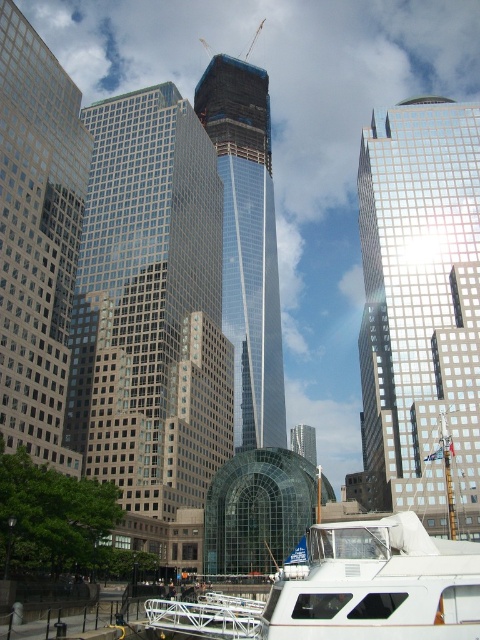
Who is lower down, glassy skyscraper at center or transparent glass skyscraper at center?

Positioned lower is glassy skyscraper at center.

Is point (99, 211) more distant than point (238, 77)?

No.

Locate an element on the screen. The height and width of the screenshot is (640, 480). glassy skyscraper at center is located at coordinates (152, 316).

Between reflective glass skyscraper at center and transparent glass skyscraper at center, which one appears on the right side from the viewer's perspective?

From the viewer's perspective, reflective glass skyscraper at center appears more on the right side.

Is reflective glass skyscraper at center to the right of transparent glass skyscraper at center from the viewer's perspective?

Correct, you'll find reflective glass skyscraper at center to the right of transparent glass skyscraper at center.

Is point (367, 128) farther from viewer compared to point (235, 412)?

That is True.

Where is `reflective glass skyscraper at center`? This screenshot has height=640, width=480. reflective glass skyscraper at center is located at coordinates (420, 307).

What do you see at coordinates (152, 316) in the screenshot? I see `glassy skyscraper at center` at bounding box center [152, 316].

Does glassy skyscraper at center lie in front of white matte boat at lower right?

No, glassy skyscraper at center is behind white matte boat at lower right.

Does point (64, 416) lie in front of point (459, 609)?

That is False.

You are a GUI agent. You are given a task and a screenshot of the screen. Output one action in this format:
    pyautogui.click(x=<x>, y=<y>)
    Task: Click on the glassy skyscraper at center
    The width and height of the screenshot is (480, 640).
    Given the screenshot: What is the action you would take?
    (x=152, y=316)